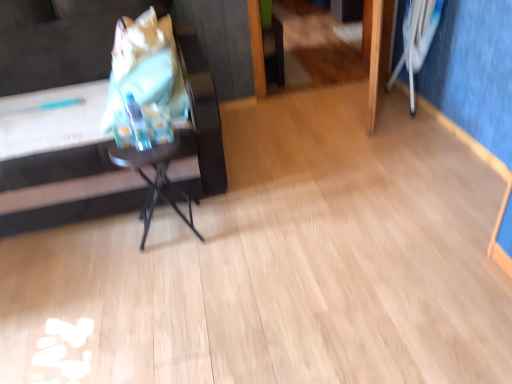
Where is `free space between metallic black table at center and white fabric swivel chair at upper right`? Image resolution: width=512 pixels, height=384 pixels. free space between metallic black table at center and white fabric swivel chair at upper right is located at coordinates (298, 167).